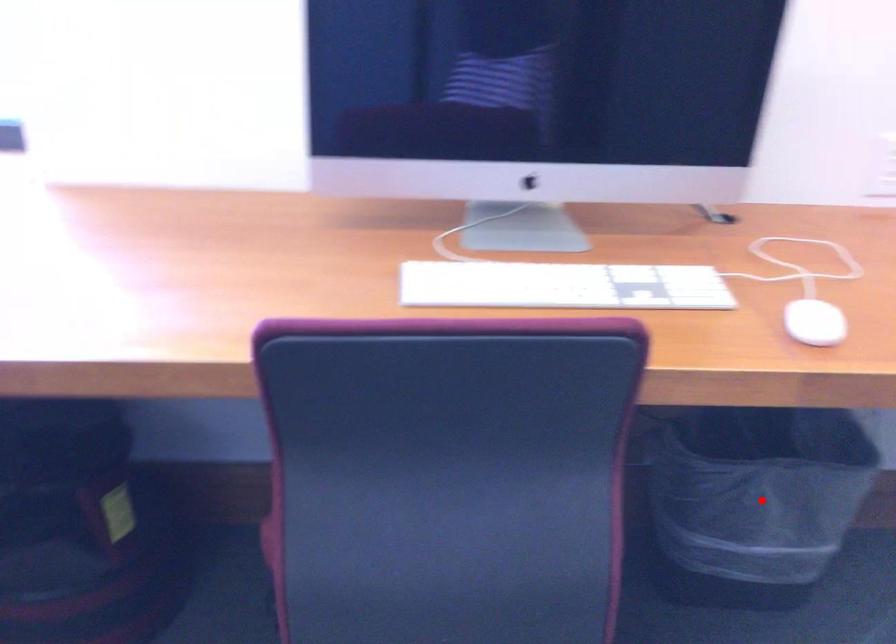
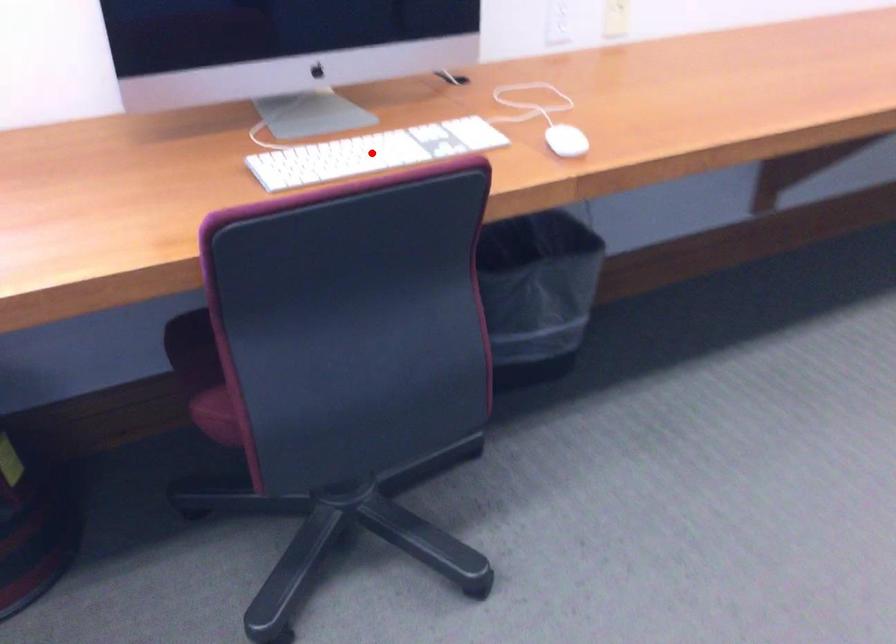
From the picture: I am providing you with two images of the same scene from different viewpoints. A red point is marked on the first image and another point is marked on the second image. Are the points marked in image1 and image2 representing the same 3D position?

No